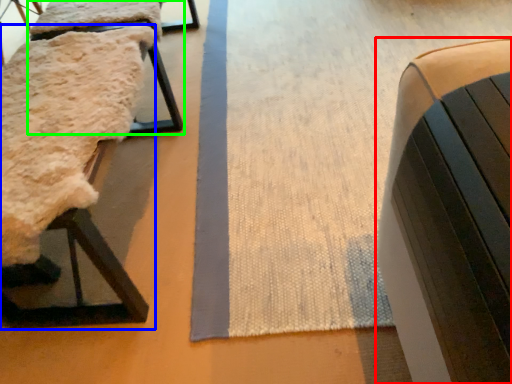
Question: Which object is positioned farthest from furniture (highlighted by a red box)? Select from furniture (highlighted by a blue box) and furniture (highlighted by a green box).

Choices:
 (A) furniture
 (B) furniture

Answer: (B)